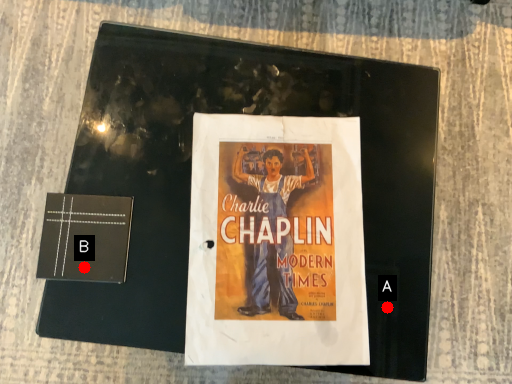
Question: Two points are circled on the image, labeled by A and B beside each circle. Which point appears farthest from the camera in this image?

Choices:
 (A) A is further
 (B) B is further

Answer: (A)